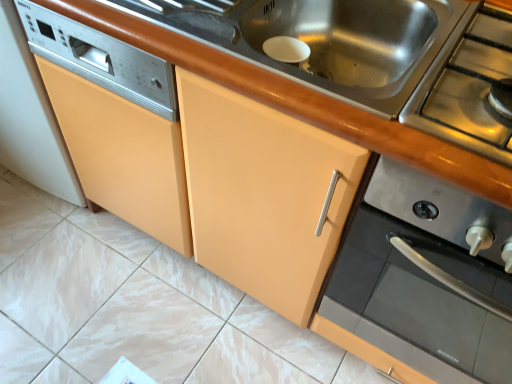
Question: Does stainless steel gas stove at right come in front of stainless steel sink at center?

Choices:
 (A) no
 (B) yes

Answer: (B)

Question: From a real-world perspective, is stainless steel gas stove at right located beneath stainless steel sink at center?

Choices:
 (A) yes
 (B) no

Answer: (B)

Question: From a real-world perspective, is stainless steel gas stove at right on stainless steel sink at center?

Choices:
 (A) yes
 (B) no

Answer: (A)

Question: Does stainless steel gas stove at right appear on the right side of stainless steel sink at center?

Choices:
 (A) no
 (B) yes

Answer: (B)

Question: From the image's perspective, does stainless steel gas stove at right appear lower than stainless steel sink at center?

Choices:
 (A) yes
 (B) no

Answer: (A)

Question: Is stainless steel gas stove at right inside the boundaries of stainless steel stove at upper right, or outside?

Choices:
 (A) outside
 (B) inside

Answer: (A)

Question: Visually, is stainless steel gas stove at right positioned to the left or to the right of stainless steel stove at upper right?

Choices:
 (A) left
 (B) right

Answer: (A)

Question: From their relative heights in the image, would you say stainless steel gas stove at right is taller or shorter than stainless steel stove at upper right?

Choices:
 (A) short
 (B) tall

Answer: (A)

Question: Based on their sizes in the image, would you say stainless steel gas stove at right is bigger or smaller than stainless steel stove at upper right?

Choices:
 (A) small
 (B) big

Answer: (A)

Question: Is stainless steel stove at upper right inside or outside of stainless steel sink at center?

Choices:
 (A) outside
 (B) inside

Answer: (A)

Question: In terms of size, does stainless steel stove at upper right appear bigger or smaller than stainless steel sink at center?

Choices:
 (A) small
 (B) big

Answer: (B)

Question: From the image's perspective, is stainless steel stove at upper right positioned above or below stainless steel sink at center?

Choices:
 (A) below
 (B) above

Answer: (A)

Question: Is stainless steel stove at upper right wider or thinner than stainless steel sink at center?

Choices:
 (A) wide
 (B) thin

Answer: (A)

Question: Considering the positions of point (302, 1) and point (507, 357), is point (302, 1) closer or farther from the camera than point (507, 357)?

Choices:
 (A) farther
 (B) closer

Answer: (A)

Question: Is stainless steel sink at center in front of or behind stainless steel stove at upper right in the image?

Choices:
 (A) front
 (B) behind

Answer: (B)